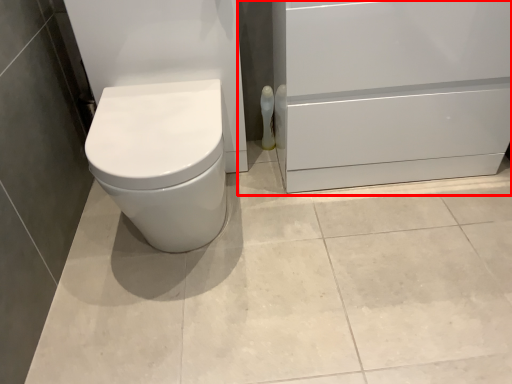
Question: Considering the relative positions of file cabinet (annotated by the red box) and toilet paper in the image provided, where is file cabinet (annotated by the red box) located with respect to the staircase?

Choices:
 (A) right
 (B) left

Answer: (A)